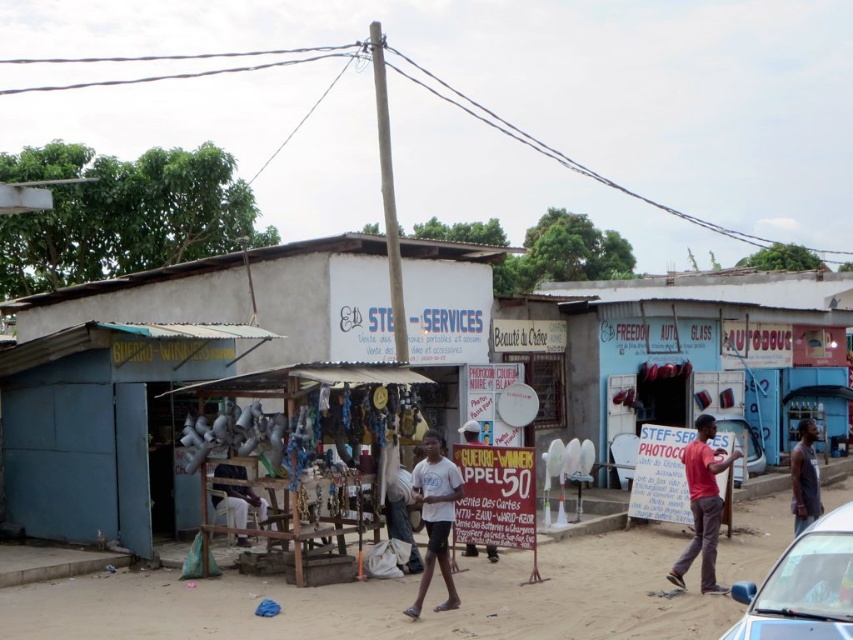
You are a delivery person trying to deliver a package to the shop in the center. You see the white plastic satellite dishes at center and the white matte person at center. Which object is bigger and could block your path if you approach the shop?

The white plastic satellite dishes at center is larger in size than the white matte person at center, so it could potentially block your path when approaching the shop.

You are a pedestrian standing at the center of the street. You want to cross to the other side but need to avoid the blue glossy car at lower right. Which direction should you move relative to the white matte person at center?

You should move to the left relative to the white matte person at center because the blue glossy car at lower right is located to the right of the white matte person at center, so moving left would take you away from the car.